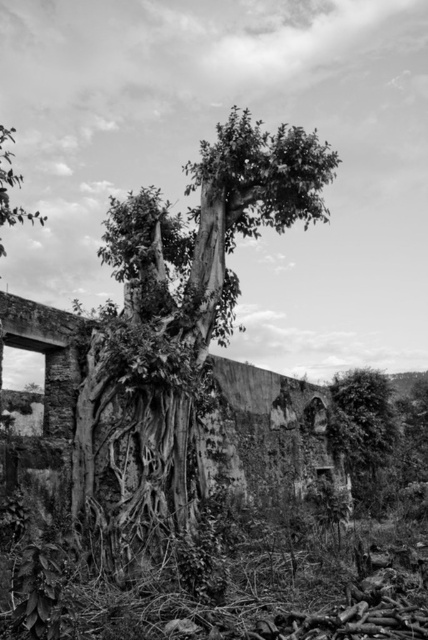
Is textured bark tree at center taller than thick textured foliage at right?

Yes.

I want to click on textured bark tree at center, so tap(175, 332).

The image size is (428, 640). I want to click on textured bark tree at center, so click(x=175, y=332).